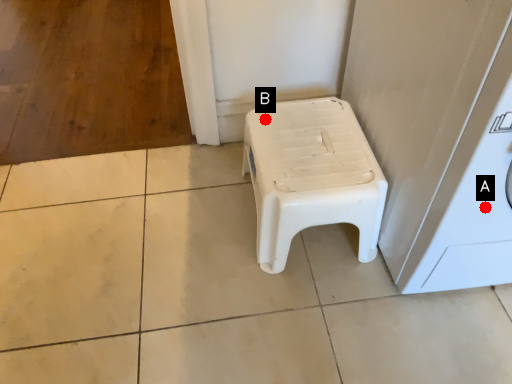
Question: Two points are circled on the image, labeled by A and B beside each circle. Which point is closer to the camera taking this photo?

Choices:
 (A) A is closer
 (B) B is closer

Answer: (A)